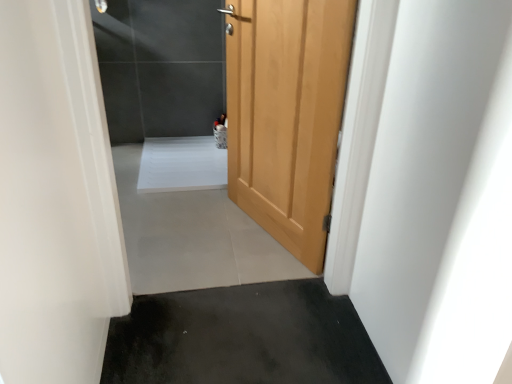
Question: Considering the relative sizes of black rubber mat at lower center, acting as the second concrete starting from the top, and wooden door at center in the image provided, is black rubber mat at lower center, acting as the second concrete starting from the top, smaller than wooden door at center?

Choices:
 (A) yes
 (B) no

Answer: (A)

Question: From the image's perspective, is black rubber mat at lower center, the first concrete positioned from the front, located above wooden door at center?

Choices:
 (A) no
 (B) yes

Answer: (A)

Question: From a real-world perspective, is black rubber mat at lower center, acting as the 2th concrete starting from the back, located beneath wooden door at center?

Choices:
 (A) yes
 (B) no

Answer: (A)

Question: Is wooden door at center surrounded by black rubber mat at lower center, the 1th concrete positioned from the bottom?

Choices:
 (A) no
 (B) yes

Answer: (A)

Question: Is black rubber mat at lower center, acting as the 2th concrete starting from the back, looking in the opposite direction of wooden door at center?

Choices:
 (A) no
 (B) yes

Answer: (A)

Question: Is wooden door at center inside the boundaries of wooden door at center, or outside?

Choices:
 (A) outside
 (B) inside

Answer: (A)

Question: Considering their positions, is wooden door at center located in front of or behind wooden door at center?

Choices:
 (A) behind
 (B) front

Answer: (A)

Question: From the image's perspective, is wooden door at center above or below wooden door at center?

Choices:
 (A) below
 (B) above

Answer: (B)

Question: In terms of width, does wooden door at center look wider or thinner when compared to wooden door at center?

Choices:
 (A) thin
 (B) wide

Answer: (A)

Question: Considering their positions, is gray tile floor at center, which is the 1th concrete from top to bottom, located in front of or behind wooden door at center?

Choices:
 (A) behind
 (B) front

Answer: (A)

Question: In terms of height, does gray tile floor at center, which appears as the 2th concrete when ordered from the bottom, look taller or shorter compared to wooden door at center?

Choices:
 (A) short
 (B) tall

Answer: (A)

Question: Is point (193, 256) closer or farther from the camera than point (284, 61)?

Choices:
 (A) closer
 (B) farther

Answer: (B)

Question: Is gray tile floor at center, the 1th concrete when ordered from back to front, wider or thinner than wooden door at center?

Choices:
 (A) thin
 (B) wide

Answer: (B)

Question: Would you say wooden door at center is to the left or to the right of black rubber mat at lower center, acting as the 2th concrete starting from the back, in the picture?

Choices:
 (A) right
 (B) left

Answer: (A)

Question: From the image's perspective, relative to black rubber mat at lower center, the first concrete positioned from the front, is wooden door at center above or below?

Choices:
 (A) below
 (B) above

Answer: (B)